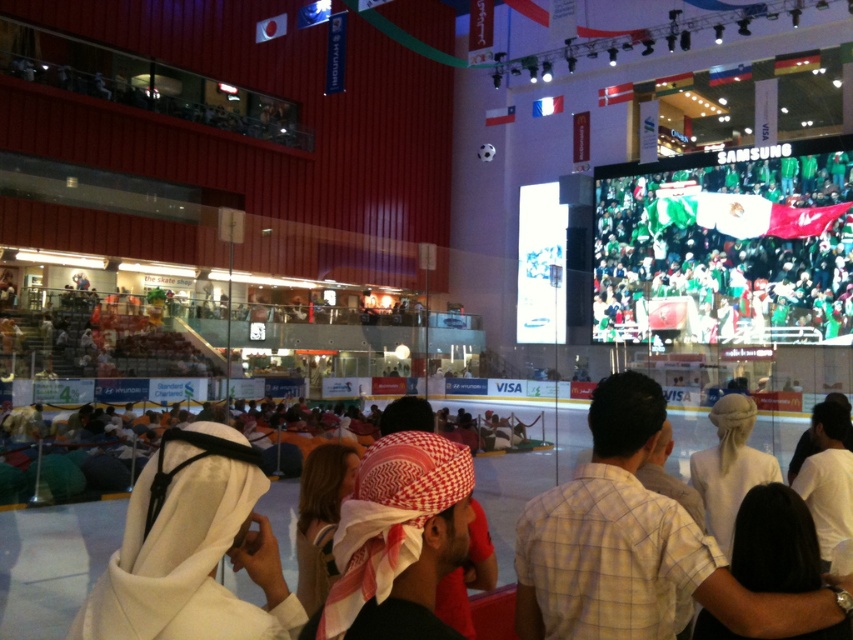
Looking at this image, which is above, white cloth headscarf at lower left or red checkered headscarf at center?

red checkered headscarf at center

Between white cloth headscarf at lower left and red checkered headscarf at center, which one is positioned lower?

white cloth headscarf at lower left is below.

Where is `white cloth headscarf at lower left`? This screenshot has width=853, height=640. white cloth headscarf at lower left is located at coordinates (192, 548).

Find the location of a particular element. white cloth headscarf at lower left is located at coordinates pos(192,548).

Does light brown checkered shirt at center have a greater height compared to white cloth headscarf at lower left?

Yes.

Which of these two, light brown checkered shirt at center or white cloth headscarf at lower left, stands taller?

With more height is light brown checkered shirt at center.

Between point (614, 588) and point (144, 509), which one is positioned behind?

Positioned behind is point (614, 588).

You are a GUI agent. You are given a task and a screenshot of the screen. Output one action in this format:
    pyautogui.click(x=<x>, y=<y>)
    Task: Click on the light brown checkered shirt at center
    
    Given the screenshot: What is the action you would take?
    pyautogui.click(x=633, y=545)

From the picture: Does green fabric crowd at upper center have a greater height compared to light brown checkered shirt at center?

Correct, green fabric crowd at upper center is much taller as light brown checkered shirt at center.

This screenshot has width=853, height=640. In order to click on green fabric crowd at upper center in this screenshot , I will do `click(724, 248)`.